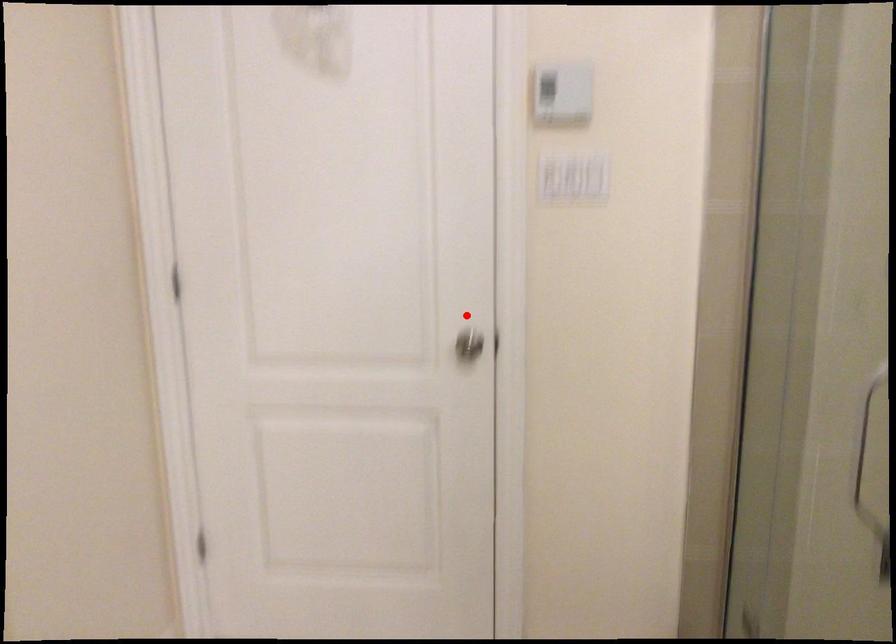
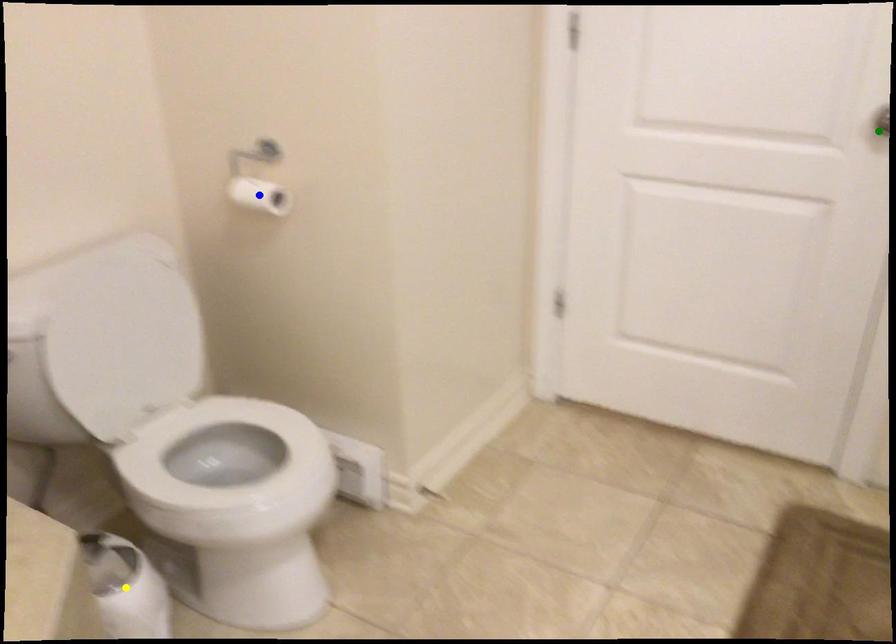
Question: I am providing you with two images of the same scene from different viewpoints. A red point is marked on the first image. You are given multiple points on the second image. Which point in image 2 represents the same 3d spot as the red point in image 1?

Choices:
 (A) yellow point
 (B) green point
 (C) blue point

Answer: (B)